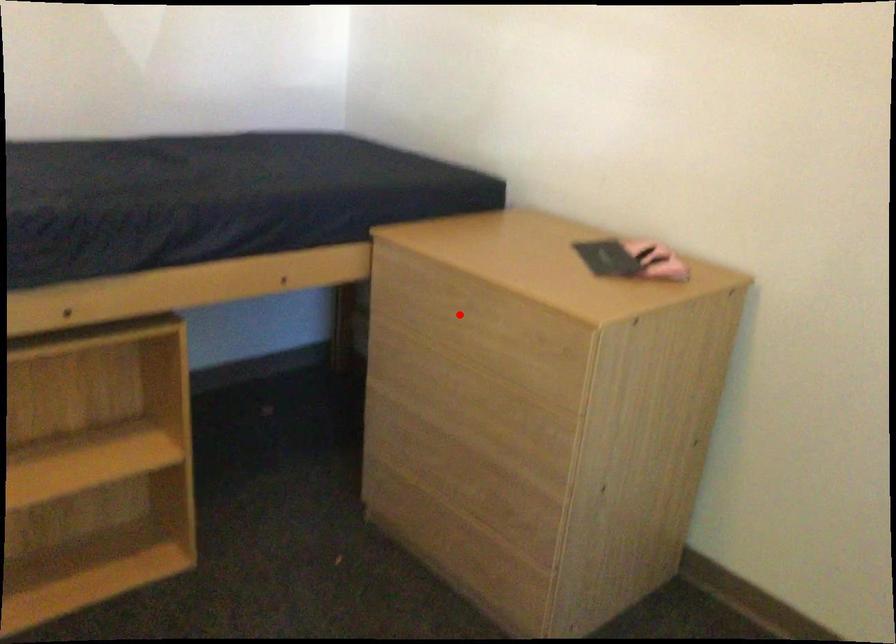
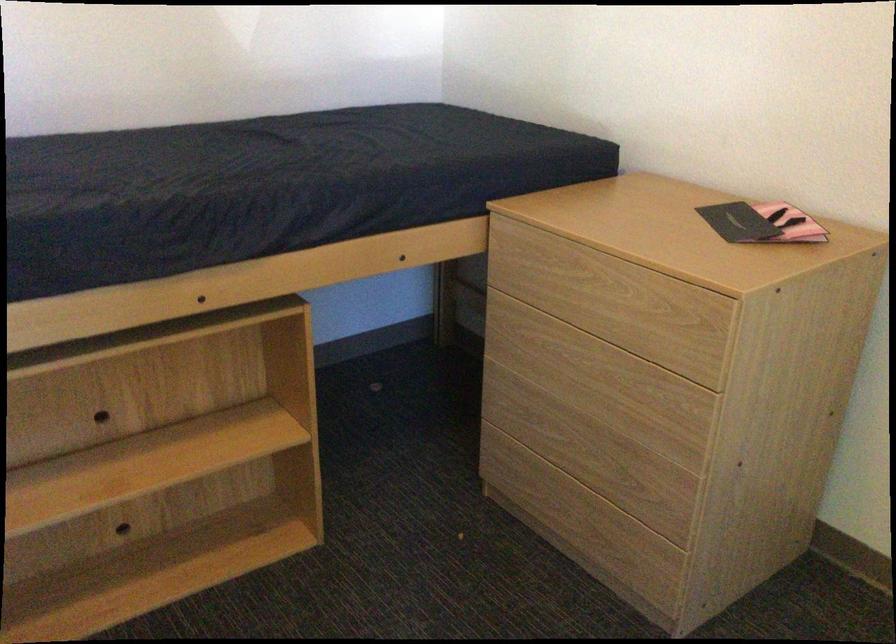
Locate, in the second image, the point that corresponds to the highlighted location in the first image.

(582, 287)